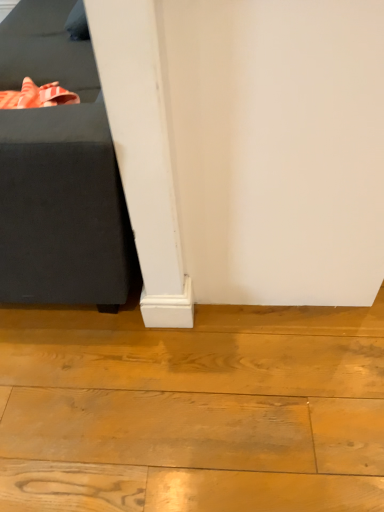
Question: Relative to natural wood floor at lower left, is black fabric ottoman at left in front or behind?

Choices:
 (A) front
 (B) behind

Answer: (A)

Question: Is black fabric ottoman at left situated inside natural wood floor at lower left or outside?

Choices:
 (A) outside
 (B) inside

Answer: (A)

Question: From the image's perspective, relative to natural wood floor at lower left, is black fabric ottoman at left above or below?

Choices:
 (A) above
 (B) below

Answer: (A)

Question: From a real-world perspective, is natural wood floor at lower left positioned above or below black fabric ottoman at left?

Choices:
 (A) below
 (B) above

Answer: (A)

Question: From their relative heights in the image, would you say natural wood floor at lower left is taller or shorter than black fabric ottoman at left?

Choices:
 (A) tall
 (B) short

Answer: (B)

Question: Based on their positions, is natural wood floor at lower left located to the left or right of black fabric ottoman at left?

Choices:
 (A) right
 (B) left

Answer: (A)

Question: Is natural wood floor at lower left situated inside black fabric ottoman at left or outside?

Choices:
 (A) outside
 (B) inside

Answer: (A)